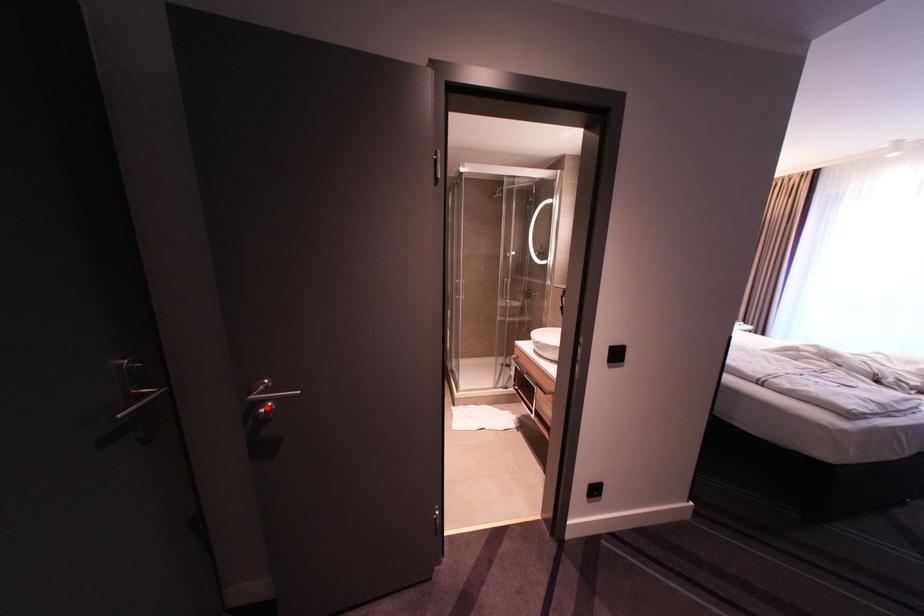
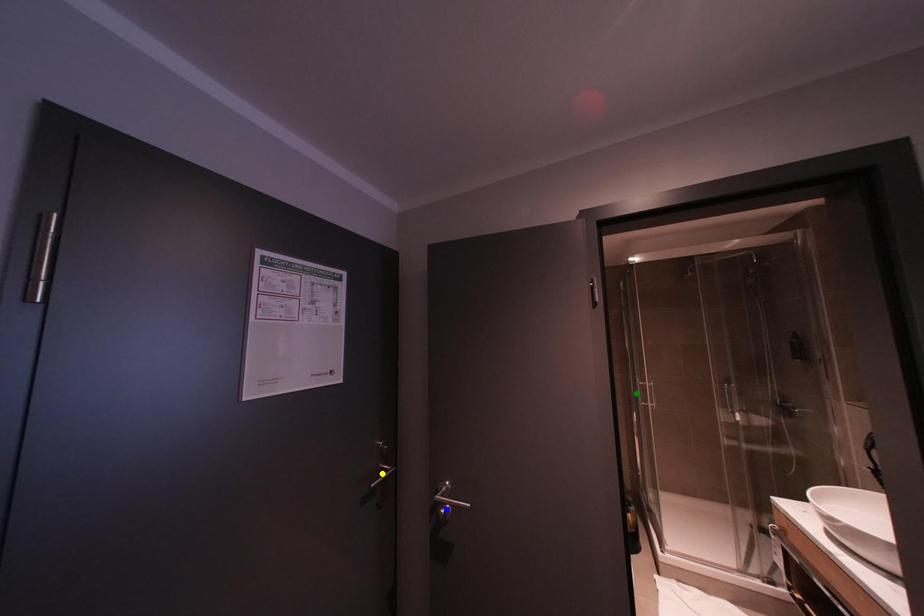
Question: I am providing you with two images of the same scene from different viewpoints. A red point is marked on the first image. You are given multiple points on the second image. Can you choose the point in image 2 that corresponds to the point in image 1?

Choices:
 (A) yellow point
 (B) blue point
 (C) green point

Answer: (B)